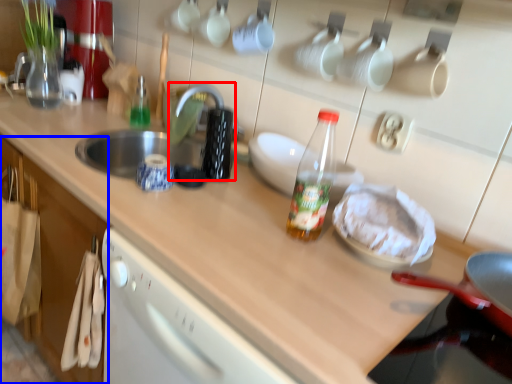
Question: Which point is further to the camera, faucet (highlighted by a red box) or cabinetry (highlighted by a blue box)?

Choices:
 (A) faucet
 (B) cabinetry

Answer: (A)